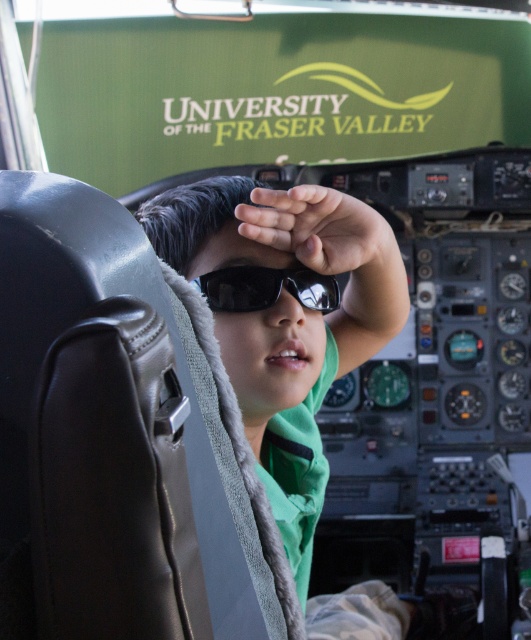
You are a flight attendant checking the cockpit for safety. You notice the green fabric at center and the black reflective sunglasses at center. Which object has a greater width?

The green fabric at center has a greater width than the black reflective sunglasses at center.

You are a pilot in the cockpit and need to access the cockpit instruments below the green banner. Can you reach them without moving the green fabric at center?

The green fabric at center is located at point [285,316], which is directly over the cockpit instruments. Moving the fabric would be necessary to access the instruments below.

You are a technician measuring the space between cockpit components. You need to install a new sensor that requires 4 inches of clearance between two objects. Given the green fabric at center and the black reflective sunglasses at center, can the sensor be placed between them?

The distance between the green fabric at center and the black reflective sunglasses at center is 3.92 inches, which is slightly less than the required 4 inches. Therefore, the sensor cannot be placed between them without violating the clearance requirement.